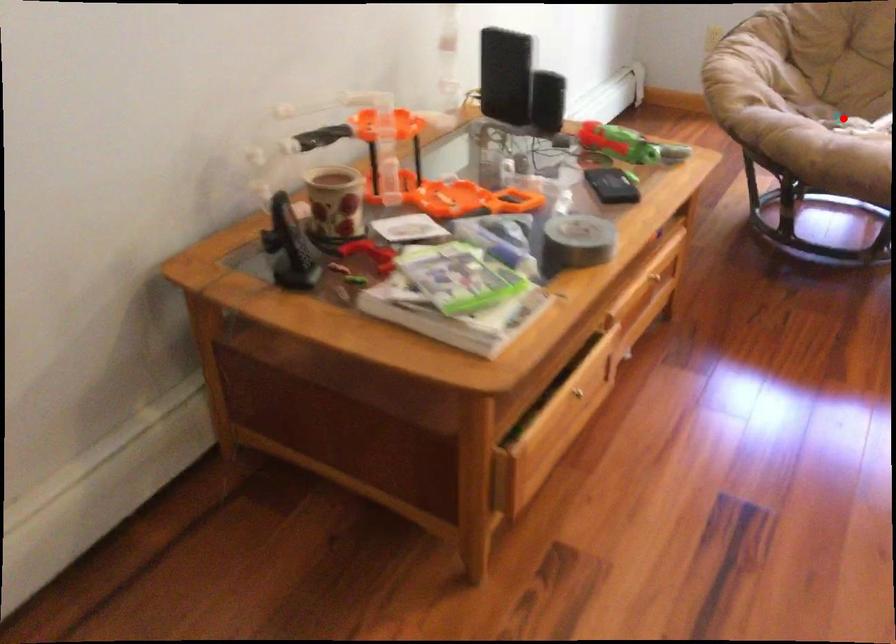
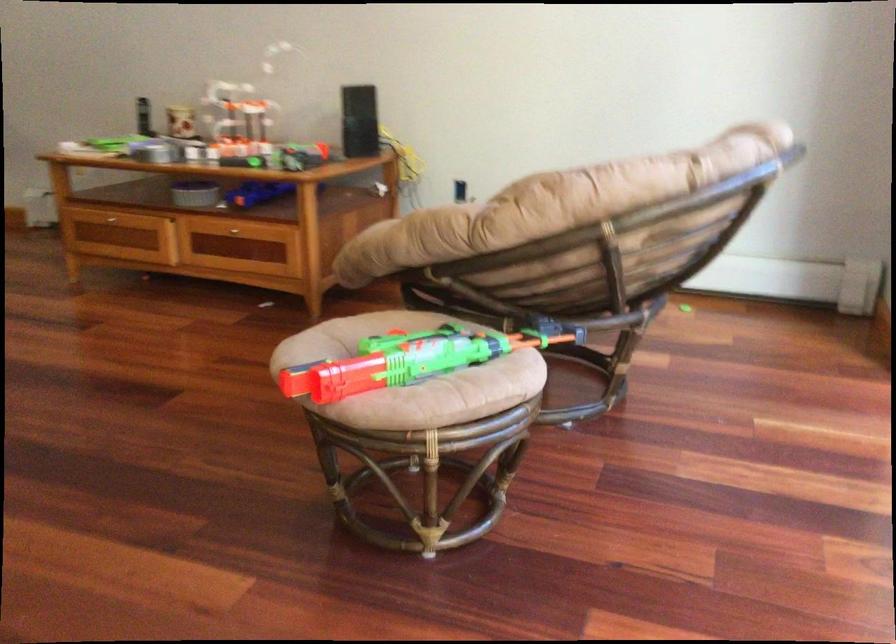
Question: I am providing you with two images of the same scene from different viewpoints. A red point is marked on the first image. At the location where the point appears in image 1, is it still visible in image 2?

Choices:
 (A) Yes
 (B) No

Answer: (B)